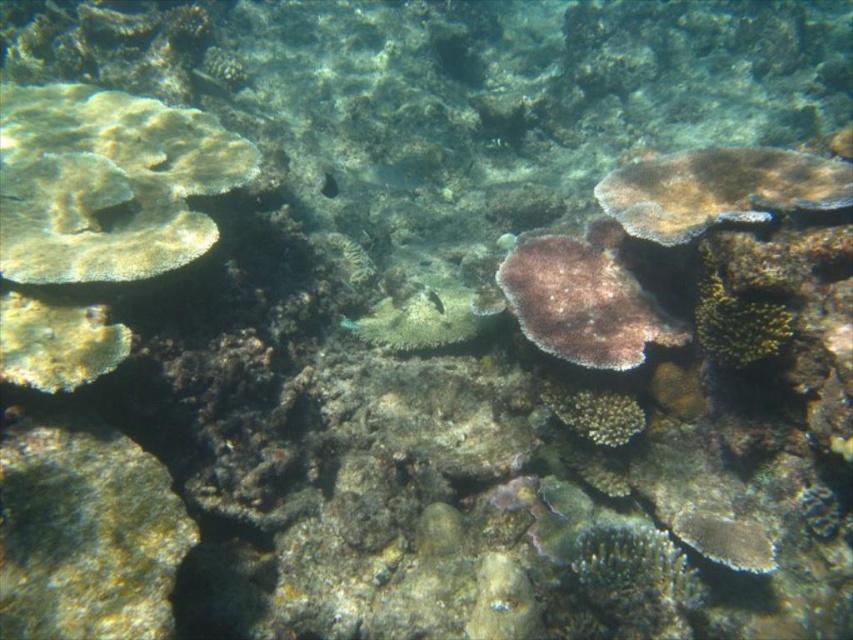
Is point (506, 298) positioned before point (323, 188)?

That is True.

Based on the photo, which is below, purple matte coral at center or translucent greenish fish at center?

purple matte coral at center is below.

Who is more distant from viewer, (549, 321) or (326, 179)?

The point (326, 179) is behind.

Identify the location of purple matte coral at center. (582, 304).

What do you see at coordinates (718, 189) in the screenshot?
I see `brown matte coral at upper right` at bounding box center [718, 189].

Who is more distant from viewer, (833,205) or (602,429)?

Positioned behind is point (602,429).

The height and width of the screenshot is (640, 853). In order to click on brown matte coral at upper right in this screenshot , I will do `click(718, 189)`.

Is point (805, 202) positioned in front of point (395, 186)?

Yes.

Who is taller, brown matte coral at upper right or translucent greenish-blue fish at center?

With more height is brown matte coral at upper right.

The image size is (853, 640). In order to click on brown matte coral at upper right in this screenshot , I will do `click(718, 189)`.

This screenshot has height=640, width=853. What are the coordinates of `brown matte coral at upper right` in the screenshot? It's located at (718, 189).